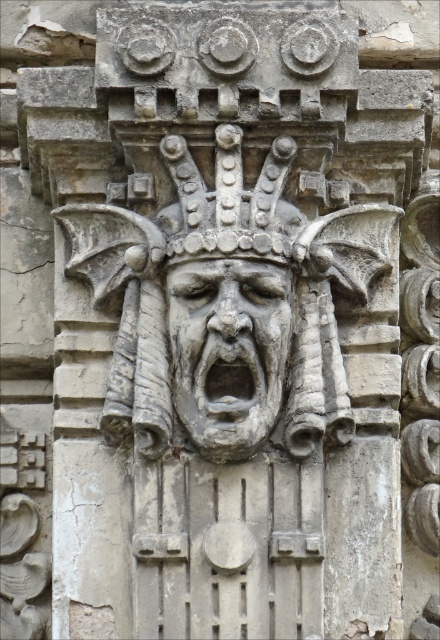
Question: Does stone carving at center lie in front of gray stone face at center?

Choices:
 (A) no
 (B) yes

Answer: (B)

Question: Is stone carving at center thinner than gray stone face at center?

Choices:
 (A) yes
 (B) no

Answer: (B)

Question: Which point appears closest to the camera in this image?

Choices:
 (A) (241, 400)
 (B) (245, 202)

Answer: (A)

Question: Does stone carving at center have a smaller size compared to gray stone face at center?

Choices:
 (A) yes
 (B) no

Answer: (B)

Question: Which of the following is the farthest from the observer?

Choices:
 (A) (194, 353)
 (B) (205, 273)

Answer: (A)